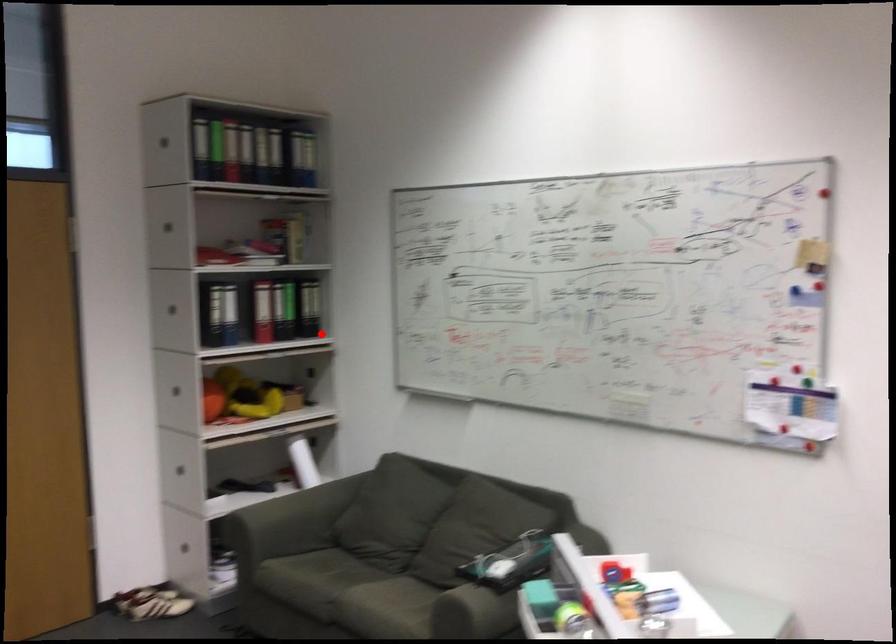
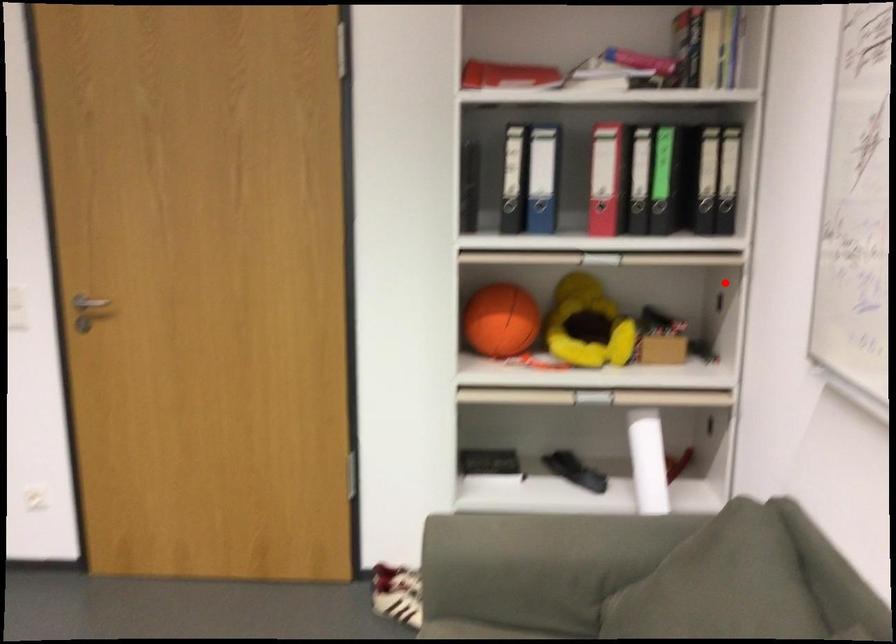
I am providing you with two images of the same scene from different viewpoints. A red point is marked on the first image and another point is marked on the second image. Does the point marked in image1 correspond to the same location as the one in image2?

No